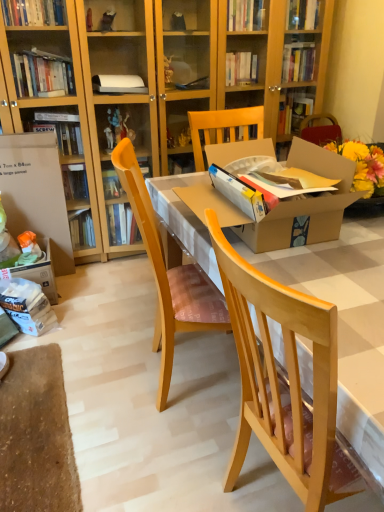
Question: Is wooden chair at center, the first chair in the left-to-right sequence, to the left or to the right of cardboard box at left in the image?

Choices:
 (A) left
 (B) right

Answer: (B)

Question: Considering the positions of wooden chair at center, which ranks as the 2th chair in right-to-left order, and cardboard box at left in the image, is wooden chair at center, which ranks as the 2th chair in right-to-left order, bigger or smaller than cardboard box at left?

Choices:
 (A) small
 (B) big

Answer: (B)

Question: Which of these objects is positioned closest to the natural wood chair at center, the 2th chair from the left?

Choices:
 (A) wooden chair at center, which ranks as the 2th chair in right-to-left order
 (B) cardboard box at left

Answer: (A)

Question: Which object is positioned closest to the cardboard box at left?

Choices:
 (A) wooden chair at center, which ranks as the 2th chair in right-to-left order
 (B) natural wood chair at center, the 2th chair from the left

Answer: (A)